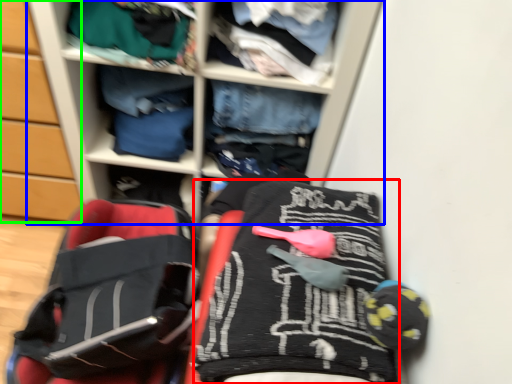
Question: Which object is positioned farthest from clothing (highlighted by a red box)? Select from shelf (highlighted by a blue box) and cabinetry (highlighted by a green box).

Choices:
 (A) shelf
 (B) cabinetry

Answer: (B)